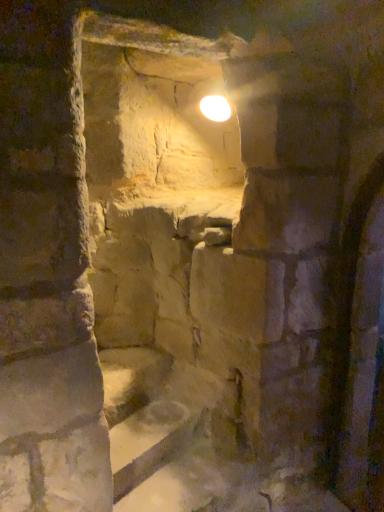
Image resolution: width=384 pixels, height=512 pixels. Find the location of `blank space situated above smooth stone stairs at lower center (from a real-world perspective)`. blank space situated above smooth stone stairs at lower center (from a real-world perspective) is located at coordinates (149, 418).